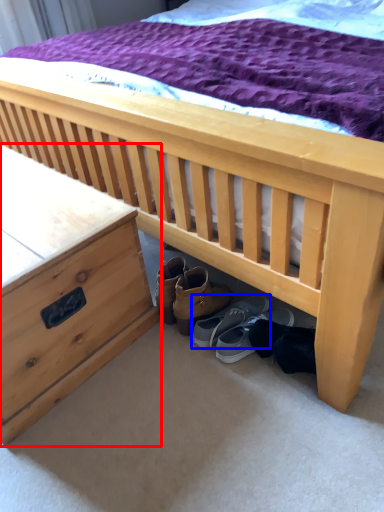
Question: Which of the following is the farthest to the observer, nightstand (highlighted by a red box) or footwear (highlighted by a blue box)?

Choices:
 (A) nightstand
 (B) footwear

Answer: (B)